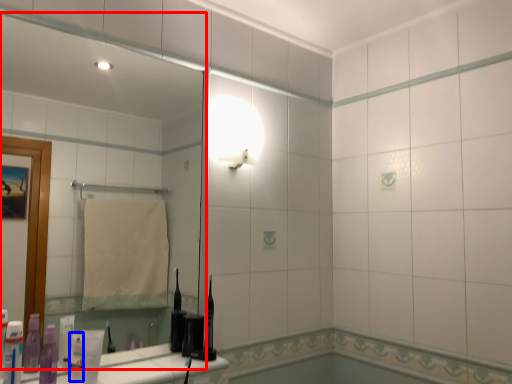
Question: Which object is further to the camera taking this photo, mirror (highlighted by a red box) or toiletry (highlighted by a blue box)?

Choices:
 (A) mirror
 (B) toiletry

Answer: (B)